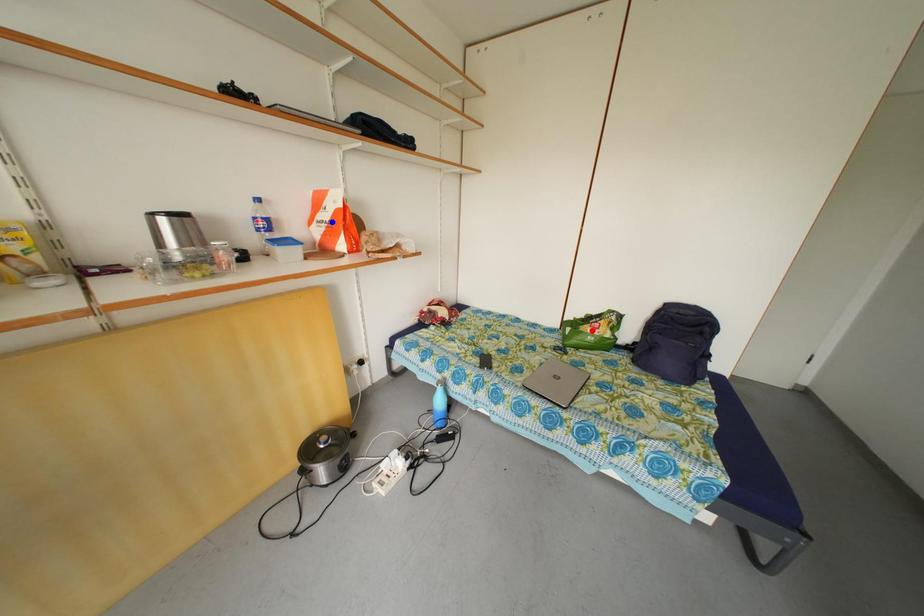
Question: In the image, two points are highlighted. Which point is nearer to the camera? Reply with the corresponding letter.

Choices:
 (A) blue point
 (B) red point

Answer: (A)